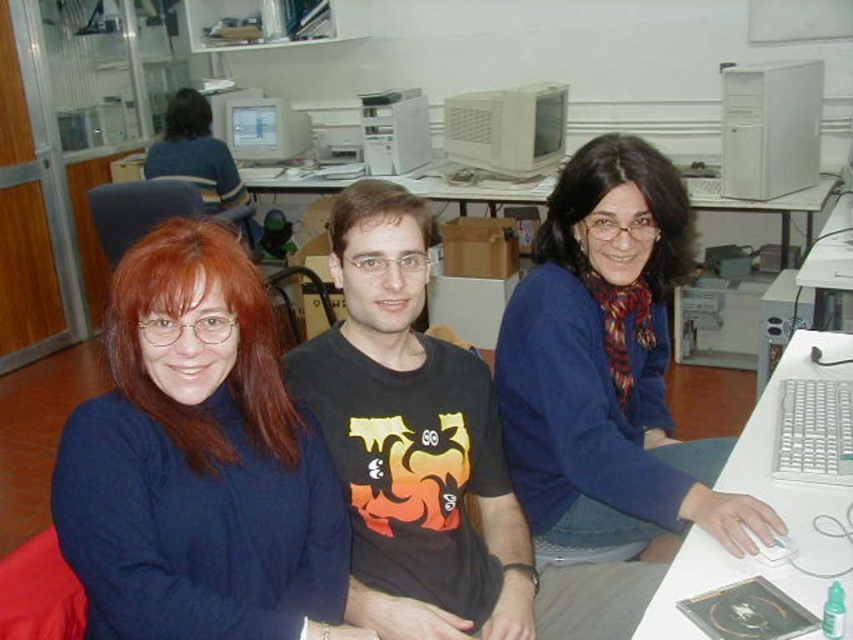
What do you see at coordinates (198, 461) in the screenshot? Image resolution: width=853 pixels, height=640 pixels. I see `blue sweater at left` at bounding box center [198, 461].

I want to click on blue sweater at left, so click(x=198, y=461).

Describe the element at coordinates (770, 451) in the screenshot. I see `white plastic table at lower right` at that location.

Between white plastic table at lower right and matte gray monitor at center, which one has less height?

With less height is matte gray monitor at center.

Is point (637, 634) positioned in front of point (286, 128)?

Yes, point (637, 634) is in front of point (286, 128).

Where is `white plastic table at lower right`? The image size is (853, 640). white plastic table at lower right is located at coordinates (770, 451).

Which is below, white plastic computer tower at upper right or white plastic monitor at center?

Positioned lower is white plastic computer tower at upper right.

Which of these two, white plastic computer tower at upper right or white plastic monitor at center, stands shorter?

Standing shorter between the two is white plastic monitor at center.

The width and height of the screenshot is (853, 640). I want to click on white plastic computer tower at upper right, so click(769, 129).

This screenshot has height=640, width=853. Find the location of `white plastic computer tower at upper right`. white plastic computer tower at upper right is located at coordinates click(x=769, y=129).